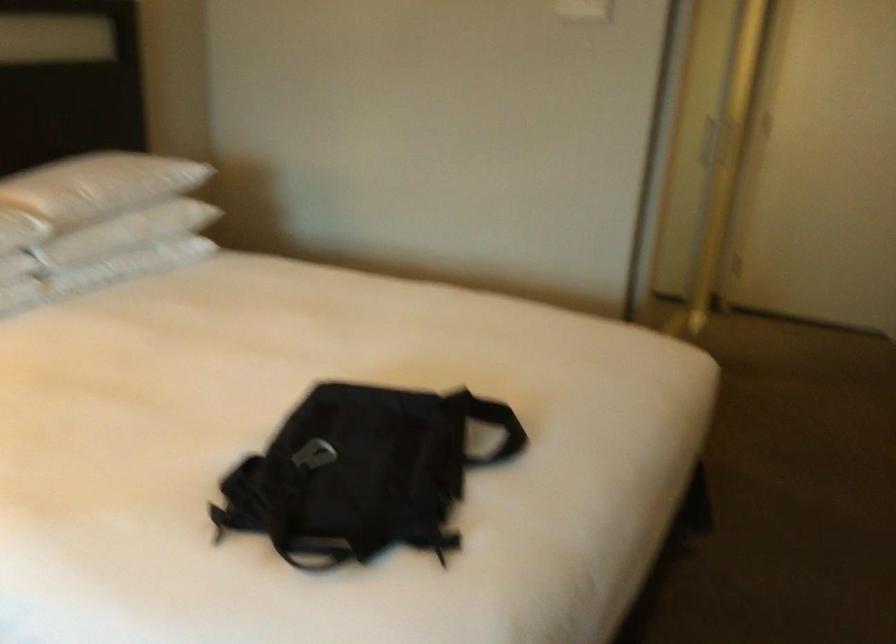
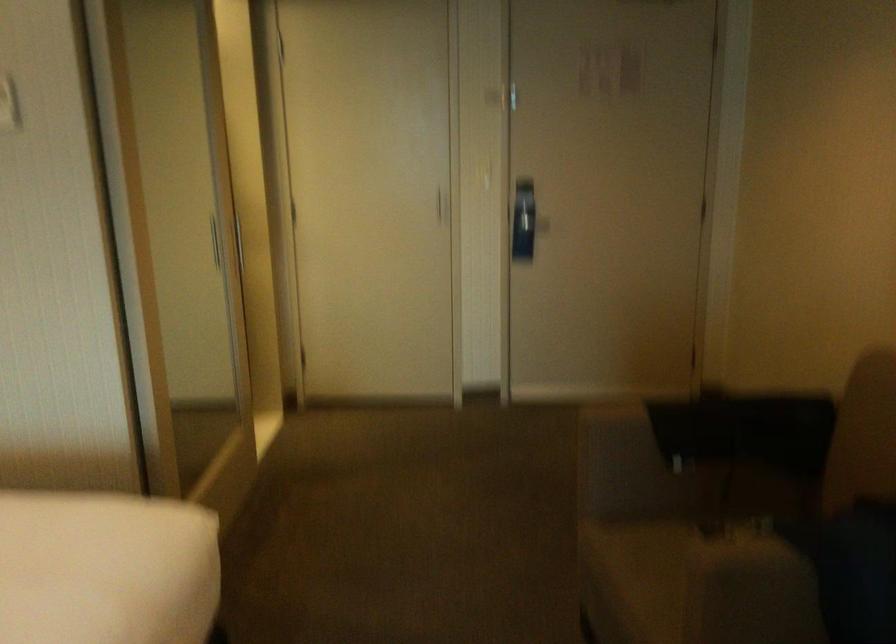
Question: The camera is either moving clockwise (left) or counter-clockwise (right) around the object. The first image is from the beginning of the video and the second image is from the end. Is the camera moving left or right when shooting the video?

Choices:
 (A) Left
 (B) Right

Answer: (A)